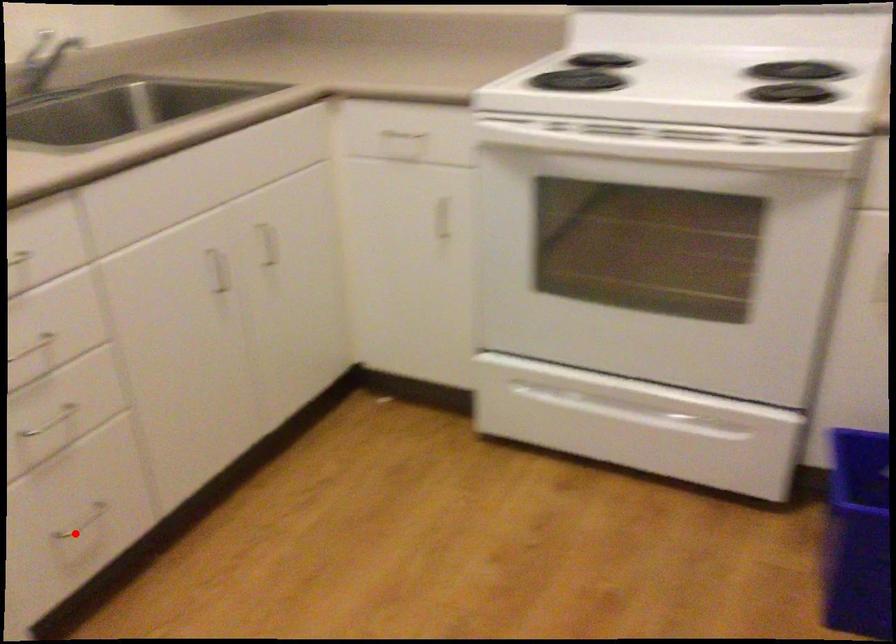
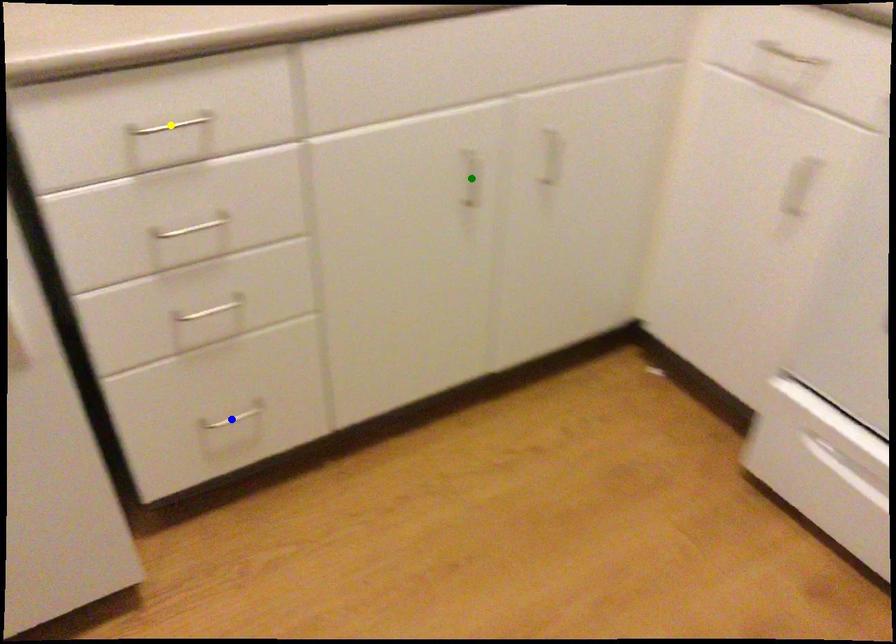
Question: I am providing you with two images of the same scene from different viewpoints. A red point is marked on the first image. You are given multiple points on the second image. Can you choose the point in image 2 that corresponds to the point in image 1?

Choices:
 (A) yellow point
 (B) green point
 (C) blue point

Answer: (C)